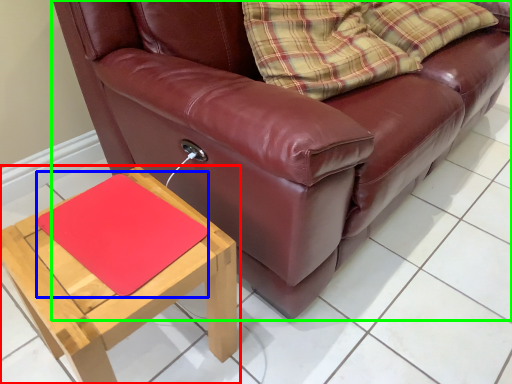
Question: Which object is the closest to the table (highlighted by a red box)? Choose among these: mat (highlighted by a blue box) or studio couch (highlighted by a green box).

Choices:
 (A) mat
 (B) studio couch

Answer: (A)